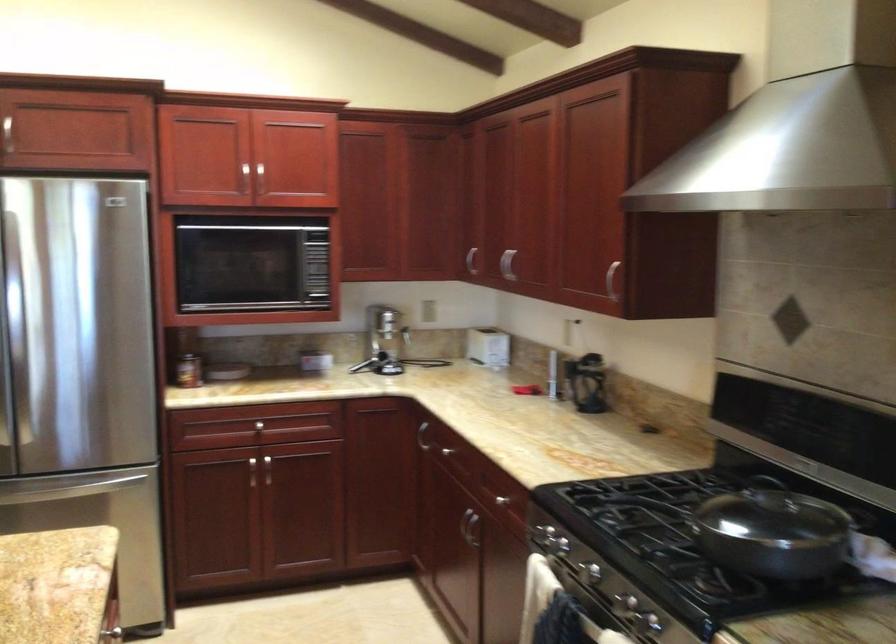
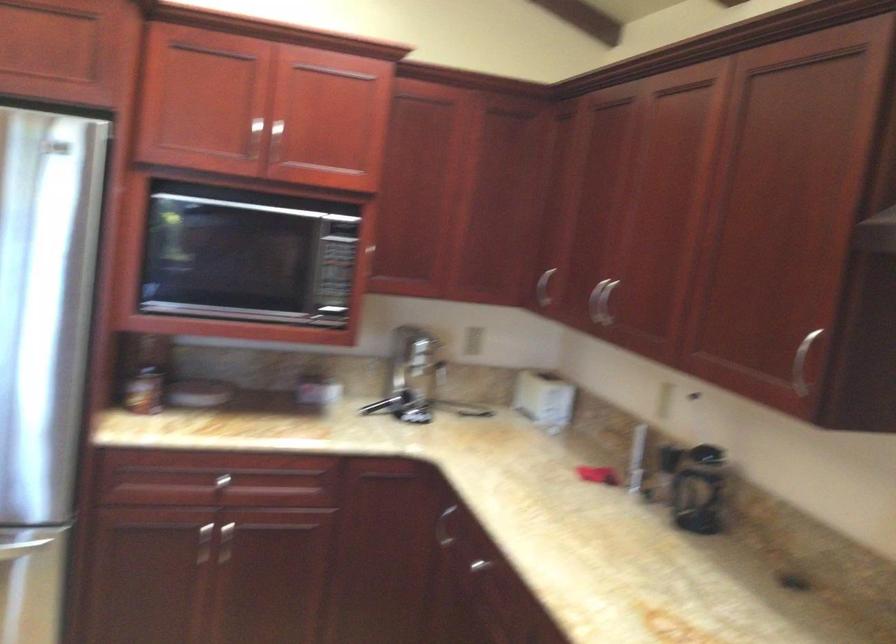
Question: The camera is either moving clockwise (left) or counter-clockwise (right) around the object. The first image is from the beginning of the video and the second image is from the end. Is the camera moving left or right when shooting the video?

Choices:
 (A) Left
 (B) Right

Answer: (B)